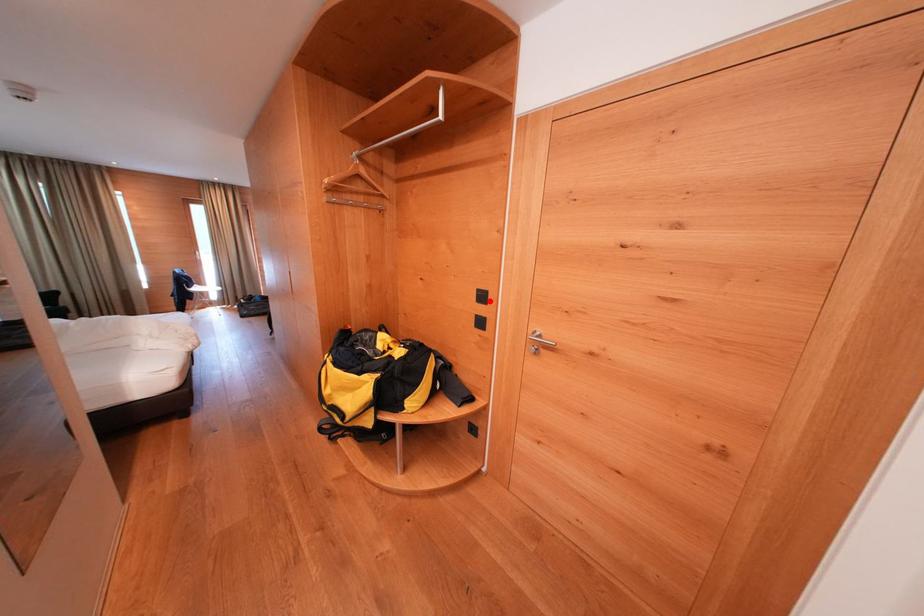
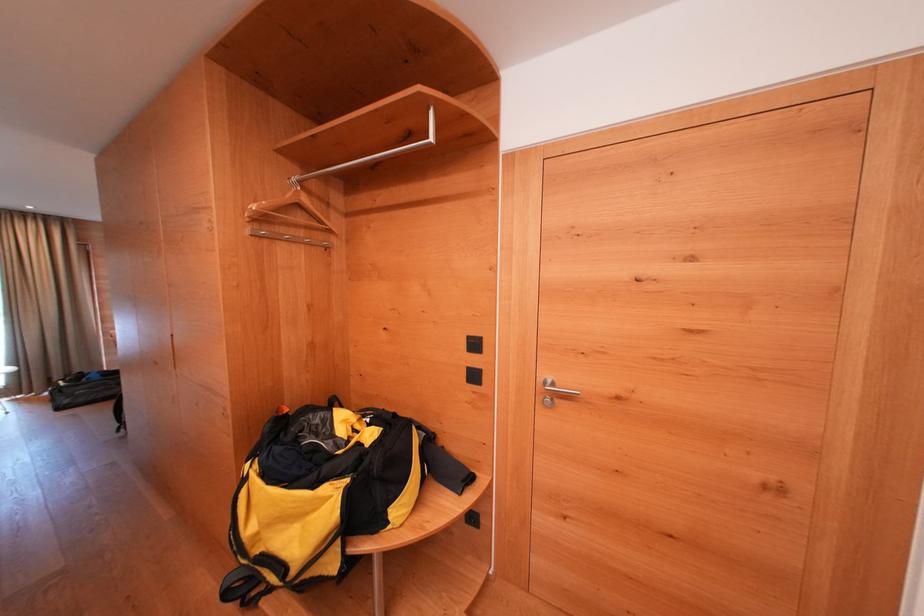
Where in the second image is the point corresponding to the highlighted location from the first image?

(481, 349)